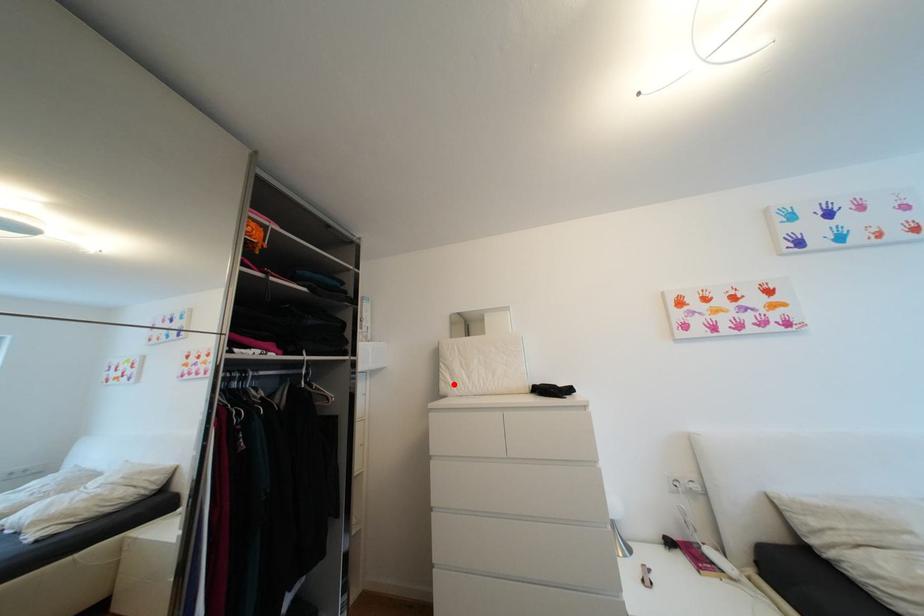
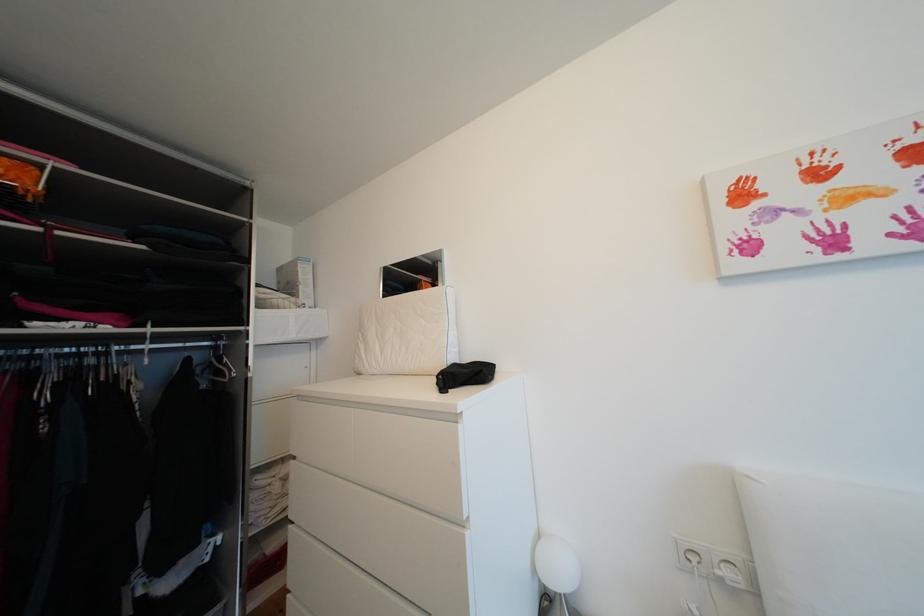
Locate, in the second image, the point that corresponds to the highlighted location in the first image.

(368, 359)